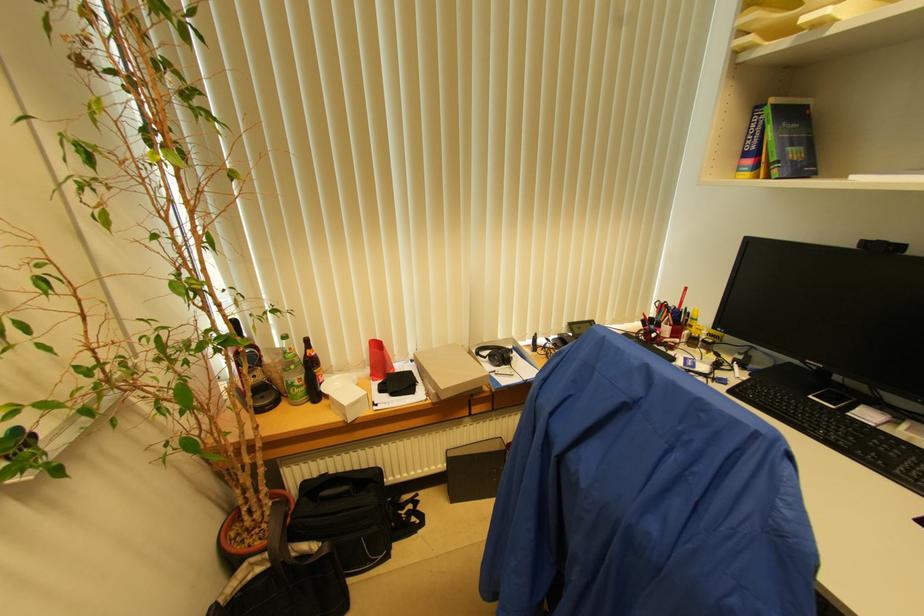
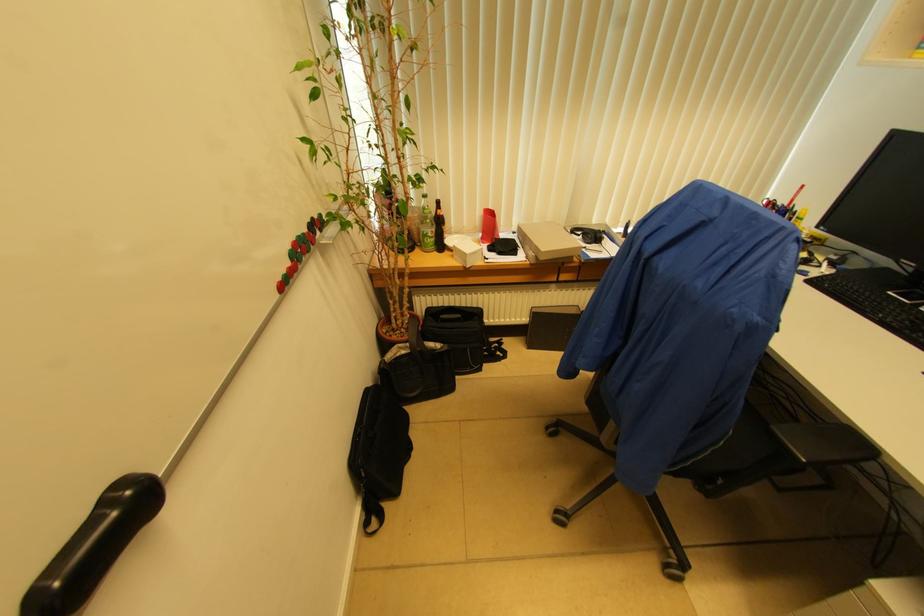
The point at (506, 358) is marked in the first image. Where is the corresponding point in the second image?

(599, 237)